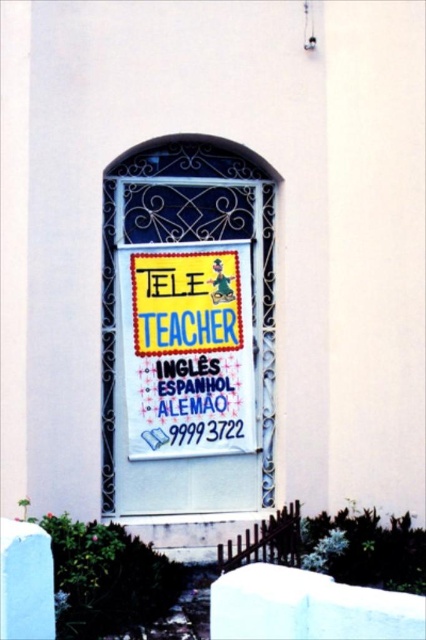
Is white paper sign at center smaller than yellow fabric poster at center?

No, white paper sign at center is not smaller than yellow fabric poster at center.

The width and height of the screenshot is (426, 640). I want to click on white paper sign at center, so click(x=187, y=330).